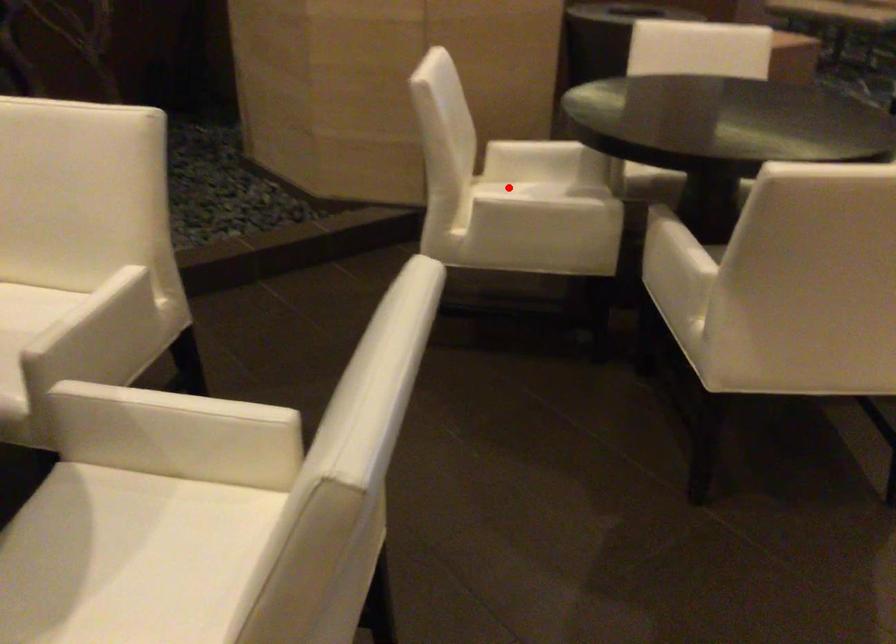
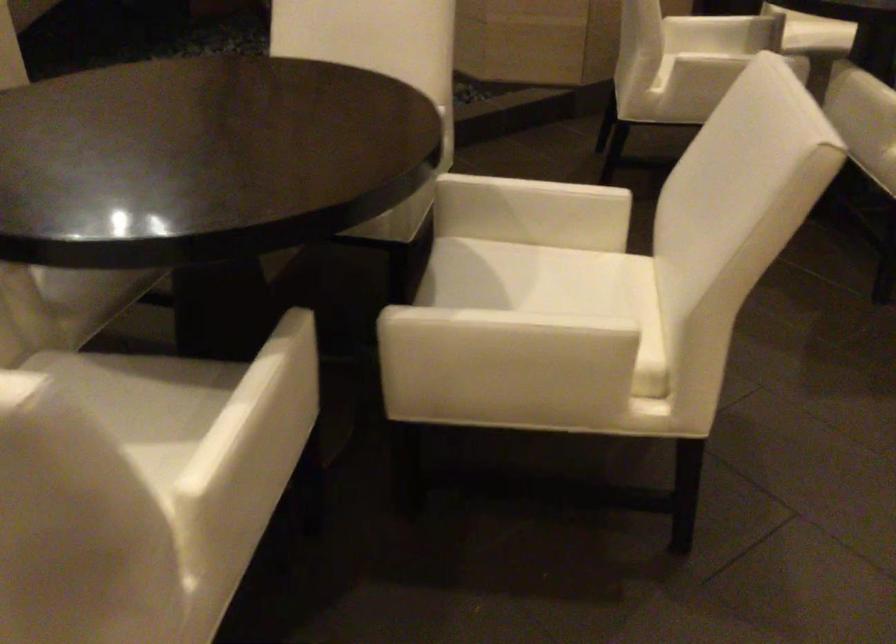
Question: A red point is marked in image1. In image2, is the corresponding 3D point closer to the camera or farther? Reply with the corresponding letter.

Choices:
 (A) The corresponding 3D point is closer.
 (B) The corresponding 3D point is farther.

Answer: (B)